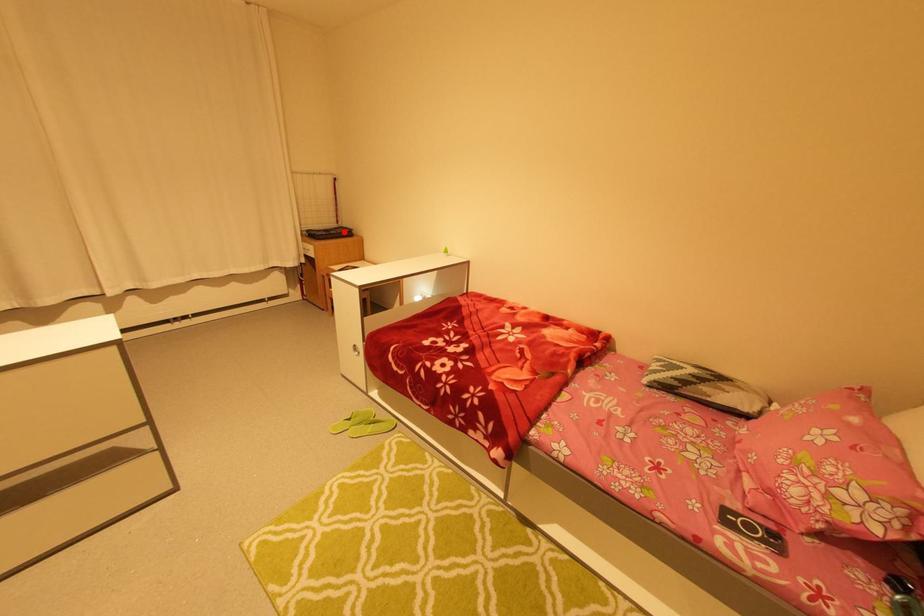
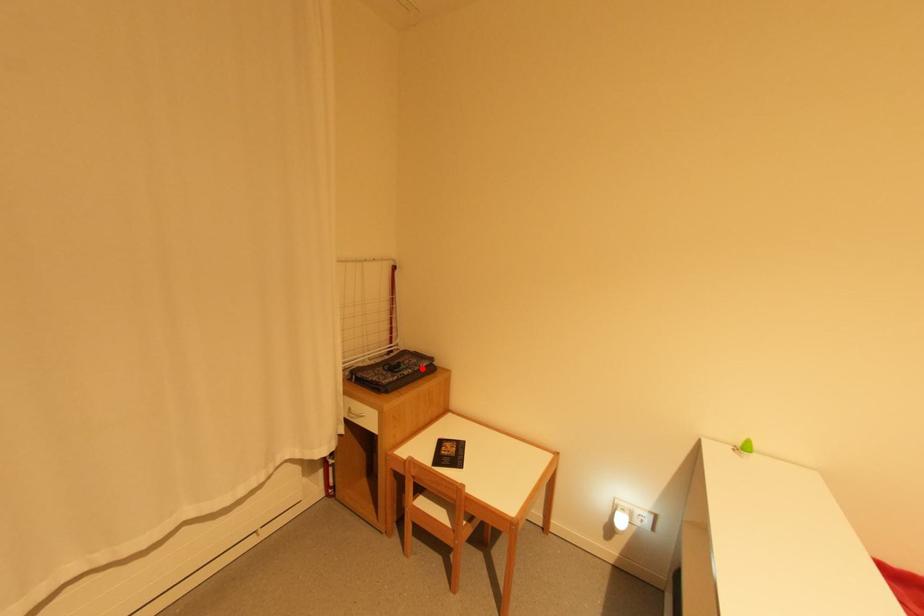
I am providing you with two images of the same scene from different viewpoints. A red point is marked on the first image and another point is marked on the second image. Do the highlighted points in image1 and image2 indicate the same real-world spot?

Yes